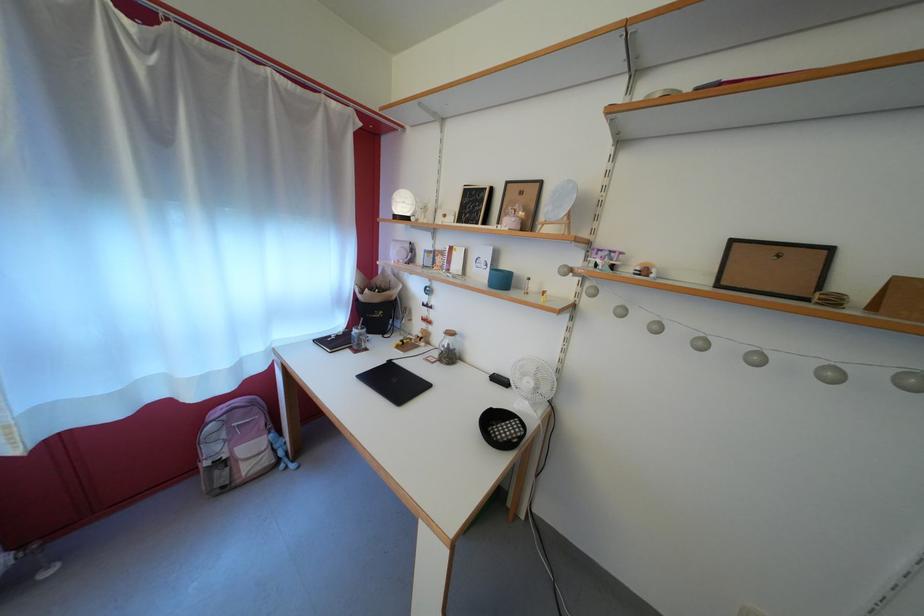
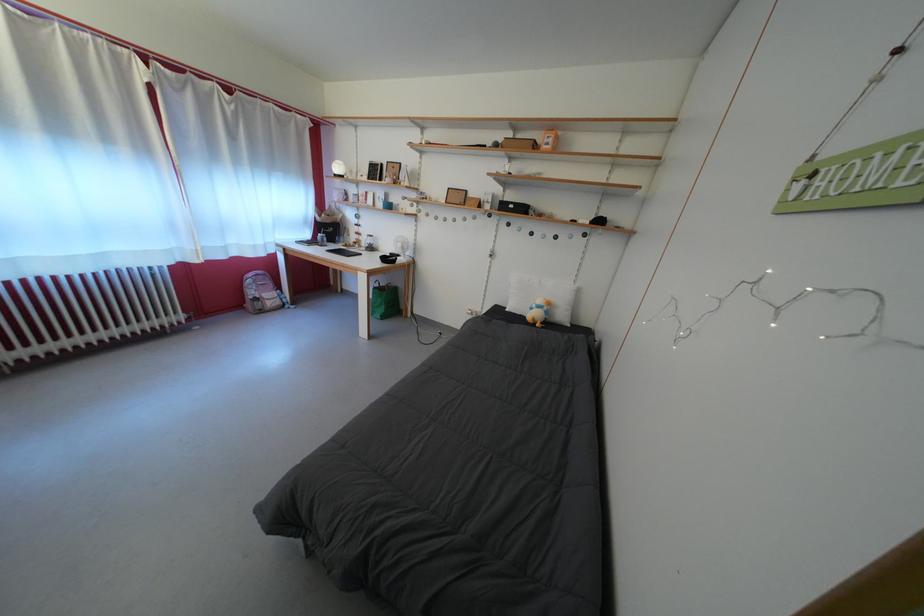
Where in the second image is the point corresponding to point 223,456 from the first image?

(261, 299)